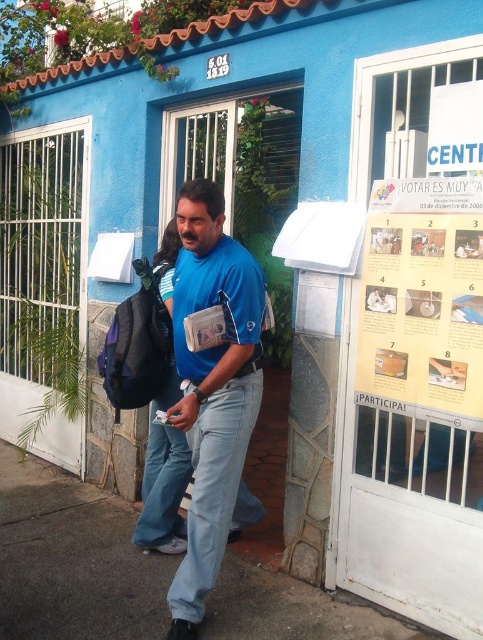
Question: Can you confirm if gray concrete pavement at lower center is positioned above yellow paper poster at upper right?

Choices:
 (A) no
 (B) yes

Answer: (A)

Question: Which of these objects is positioned closest to the gray concrete pavement at lower center?

Choices:
 (A) blue cotton shirt at center
 (B) yellow paper poster at upper right

Answer: (A)

Question: Estimate the real-world distances between objects in this image. Which object is farther from the blue cotton shirt at center?

Choices:
 (A) yellow paper poster at upper right
 (B) gray concrete pavement at lower center

Answer: (B)

Question: Is gray concrete pavement at lower center bigger than blue cotton shirt at center?

Choices:
 (A) no
 (B) yes

Answer: (B)

Question: Can you confirm if gray concrete pavement at lower center is wider than yellow paper poster at upper right?

Choices:
 (A) no
 (B) yes

Answer: (B)

Question: Which point appears farthest from the camera in this image?

Choices:
 (A) (239, 435)
 (B) (20, 560)

Answer: (B)